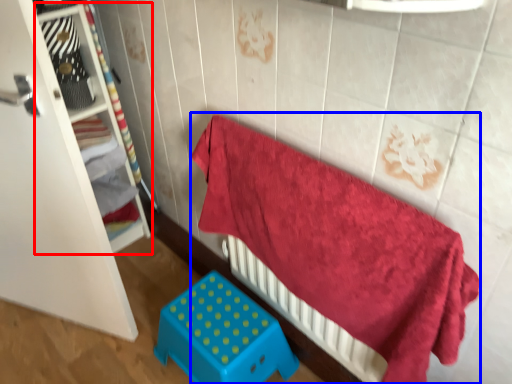
Question: Which object appears closest to the camera in this image, shelf (highlighted by a red box) or bed (highlighted by a blue box)?

Choices:
 (A) shelf
 (B) bed

Answer: (B)